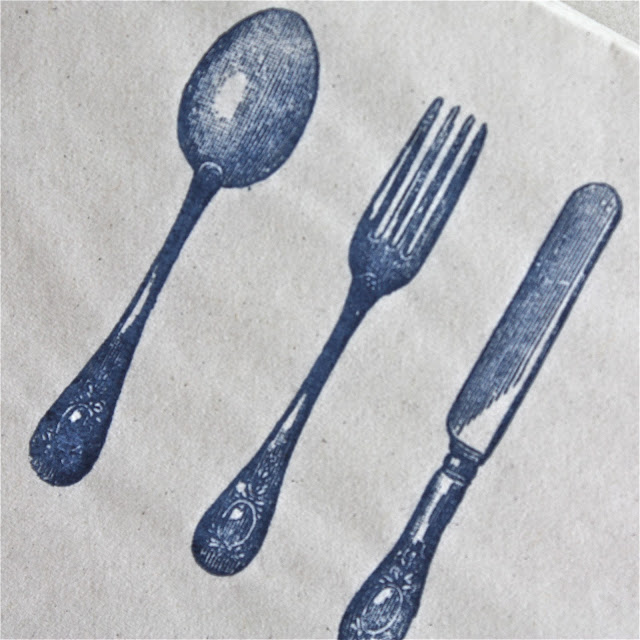
You are a GUI agent. You are given a task and a screenshot of the screen. Output one action in this format:
    pyautogui.click(x=<x>, y=<y>)
    Task: Click on the flat part of a butter knife
    This screenshot has height=640, width=640.
    Given the screenshot: What is the action you would take?
    pyautogui.click(x=506, y=397), pyautogui.click(x=536, y=292), pyautogui.click(x=580, y=227)